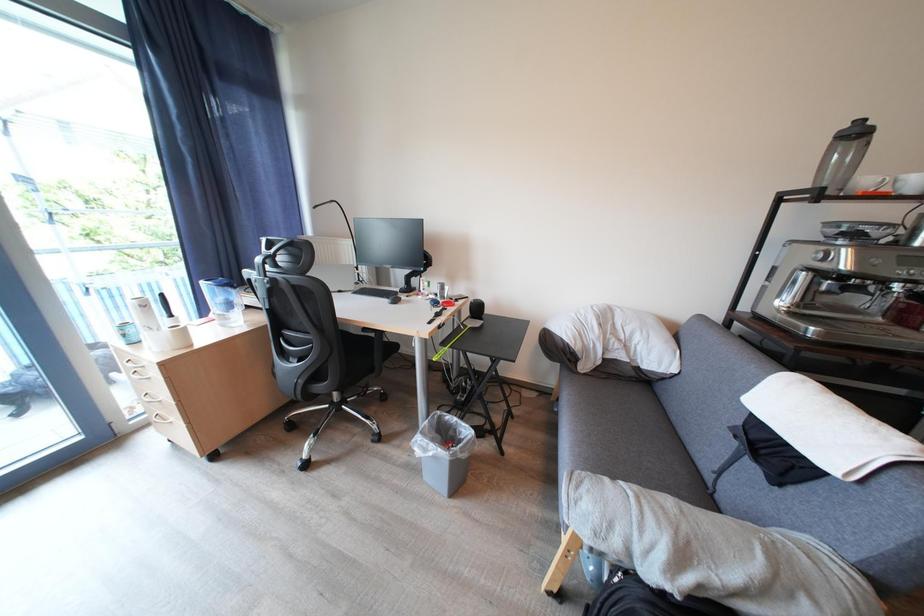
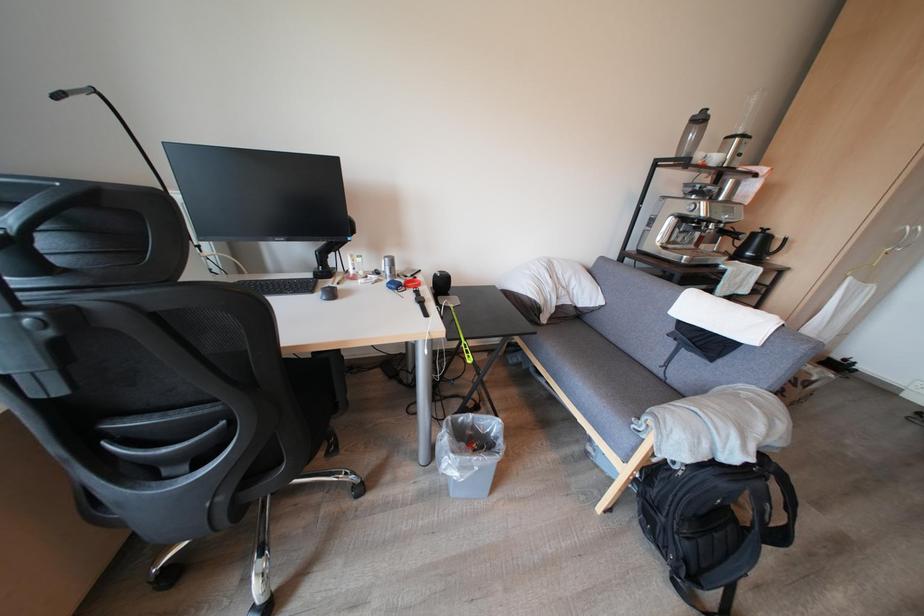
Question: The camera is either moving clockwise (left) or counter-clockwise (right) around the object. The first image is from the beginning of the video and the second image is from the end. Is the camera moving left or right when shooting the video?

Choices:
 (A) Left
 (B) Right

Answer: (A)